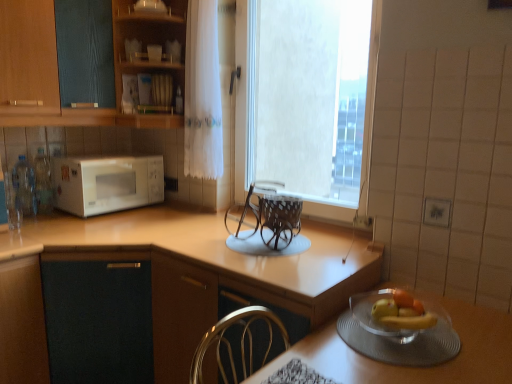
Describe the element at coordinates (146, 55) in the screenshot. This screenshot has width=512, height=384. I see `wooden shelves at upper center, arranged as the first cabinetry when viewed from the right` at that location.

Identify the location of wooden shelves at upper center, arranged as the first cabinetry when viewed from the right. Image resolution: width=512 pixels, height=384 pixels. (146, 55).

This screenshot has width=512, height=384. Describe the element at coordinates (414, 368) in the screenshot. I see `clear glass bowl at lower right` at that location.

The height and width of the screenshot is (384, 512). Describe the element at coordinates (106, 183) in the screenshot. I see `white matte microwave at left` at that location.

Measure the distance between brown woven basket at center and camera.

brown woven basket at center and camera are 1.69 meters apart from each other.

Where is `brown woven basket at center`? This screenshot has width=512, height=384. brown woven basket at center is located at coordinates (266, 223).

This screenshot has height=384, width=512. Identify the location of wooden cabinet at upper left, the second cabinetry when ordered from right to left. (57, 65).

How much space does wooden cabinet at upper left, the second cabinetry when ordered from right to left, occupy vertically?

wooden cabinet at upper left, the second cabinetry when ordered from right to left, is 69.28 centimeters in height.

The image size is (512, 384). Identify the location of white textured window at center. (306, 99).

Identify the location of wooden shelves at upper center, arranged as the first cabinetry when viewed from the right. Image resolution: width=512 pixels, height=384 pixels. (146, 55).

Can you tell me how much brown woven basket at center and clear plastic bottles at left, which is counted as the second bottle, starting from the right, differ in facing direction?

The facing directions of brown woven basket at center and clear plastic bottles at left, which is counted as the second bottle, starting from the right, are 90 degrees apart.

From the image's perspective, relative to clear plastic bottles at left, which is counted as the second bottle, starting from the right, is brown woven basket at center above or below?

From the image's perspective, brown woven basket at center appears below clear plastic bottles at left, which is counted as the second bottle, starting from the right.

Consider the image. Considering the positions of objects brown woven basket at center and clear plastic bottles at left, which is counted as the second bottle, starting from the right, in the image provided, who is in front, brown woven basket at center or clear plastic bottles at left, which is counted as the second bottle, starting from the right,?

brown woven basket at center.

Is brown woven basket at center next to clear plastic bottles at left, the first bottle in the left-to-right sequence, and touching it?

brown woven basket at center and clear plastic bottles at left, the first bottle in the left-to-right sequence, are clearly separated.

In the image, is clear plastic bottles at left, the first bottle in the left-to-right sequence, on the left side or the right side of white sheer curtain at center?

From the image, it's evident that clear plastic bottles at left, the first bottle in the left-to-right sequence, is to the left of white sheer curtain at center.

Is white sheer curtain at center surrounded by clear plastic bottles at left, which is counted as the second bottle, starting from the right?

Actually, white sheer curtain at center is outside clear plastic bottles at left, which is counted as the second bottle, starting from the right.

From the image's perspective, is clear plastic bottles at left, the first bottle in the left-to-right sequence, positioned above or below white sheer curtain at center?

Based on their image positions, clear plastic bottles at left, the first bottle in the left-to-right sequence, is located beneath white sheer curtain at center.

Is light brown laminate countertop at left not inside wooden cabinet at upper left, the second cabinetry when ordered from right to left?

light brown laminate countertop at left lies outside wooden cabinet at upper left, the second cabinetry when ordered from right to left,'s area.

From the image's perspective, is light brown laminate countertop at left located above wooden cabinet at upper left, placed as the 1th cabinetry when sorted from left to right?

No, from the image's perspective, light brown laminate countertop at left is not on top of wooden cabinet at upper left, placed as the 1th cabinetry when sorted from left to right.

Is light brown laminate countertop at left in front of or behind wooden cabinet at upper left, placed as the 1th cabinetry when sorted from left to right, in the image?

light brown laminate countertop at left is in front of wooden cabinet at upper left, placed as the 1th cabinetry when sorted from left to right.

Considering the relative sizes of light brown laminate countertop at left and wooden cabinet at upper left, placed as the 1th cabinetry when sorted from left to right, in the image provided, is light brown laminate countertop at left thinner than wooden cabinet at upper left, placed as the 1th cabinetry when sorted from left to right,?

No, light brown laminate countertop at left is not thinner than wooden cabinet at upper left, placed as the 1th cabinetry when sorted from left to right.

Consider the image. Measure the distance from brown woven basket at center to clear glass bowl at lower right.

brown woven basket at center and clear glass bowl at lower right are 25.77 inches apart from each other.

Which is behind, brown woven basket at center or clear glass bowl at lower right?

brown woven basket at center is more distant.

From the image's perspective, does brown woven basket at center appear lower than clear glass bowl at lower right?

No, from the image's perspective, brown woven basket at center is not beneath clear glass bowl at lower right.

Looking at this image, from the image's perspective, would you say light brown laminate countertop at left is shown under clear glass bottle at left, which is the second bottle from left to right?

Indeed, from the image's perspective, light brown laminate countertop at left is shown beneath clear glass bottle at left, which is the second bottle from left to right.

Is light brown laminate countertop at left situated inside clear glass bottle at left, which is the 1th bottle in right-to-left order, or outside?

light brown laminate countertop at left is not inside clear glass bottle at left, which is the 1th bottle in right-to-left order, it's outside.

From a real-world perspective, between light brown laminate countertop at left and clear glass bottle at left, which is the second bottle from left to right, who is vertically higher?

From a 3D spatial view, clear glass bottle at left, which is the second bottle from left to right, is above.

Is white textured window at center at the back of brown woven basket at center?

That's right, brown woven basket at center is facing away from white textured window at center.

Between brown woven basket at center and white textured window at center, which one is positioned behind?

white textured window at center is further away from the camera.

Is brown woven basket at center inside or outside of white textured window at center?

brown woven basket at center is located beyond the bounds of white textured window at center.

Is white matte microwave at left not inside clear plastic bottles at left, which is counted as the second bottle, starting from the right?

white matte microwave at left is positioned outside clear plastic bottles at left, which is counted as the second bottle, starting from the right.

Between white matte microwave at left and clear plastic bottles at left, which is counted as the second bottle, starting from the right, which one is positioned in front?

white matte microwave at left is more forward.

Does white matte microwave at left turn towards clear plastic bottles at left, the first bottle in the left-to-right sequence?

No, white matte microwave at left is not oriented towards clear plastic bottles at left, the first bottle in the left-to-right sequence.

The width and height of the screenshot is (512, 384). Find the location of `the 2nd bottle to the left when counting from the brown woven basket at center`. the 2nd bottle to the left when counting from the brown woven basket at center is located at coordinates (25, 186).

Where is `curtain in front of the clear plastic bottles at left, which is counted as the second bottle, starting from the right`? The height and width of the screenshot is (384, 512). curtain in front of the clear plastic bottles at left, which is counted as the second bottle, starting from the right is located at coordinates (202, 93).

Based on their spatial positions, is wooden cabinet at upper left, placed as the 1th cabinetry when sorted from left to right, or light brown laminate countertop at left closer to clear plastic bottles at left, which is counted as the second bottle, starting from the right?

wooden cabinet at upper left, placed as the 1th cabinetry when sorted from left to right, is positioned closer to the anchor clear plastic bottles at left, which is counted as the second bottle, starting from the right.

Based on the photo, looking at the image, which one is located further to clear glass bowl at lower right, white textured window at center or white matte microwave at left?

Among the two, white textured window at center is located further to clear glass bowl at lower right.

Estimate the real-world distances between objects in this image. Which object is further from clear glass bottle at left, which is the second bottle from left to right, white textured window at center or wooden cabinet at upper left, placed as the 1th cabinetry when sorted from left to right?

white textured window at center.

Looking at the image, which one is located closer to brown woven basket at center, white matte microwave at left or light brown laminate countertop at left?

light brown laminate countertop at left is positioned closer to the anchor brown woven basket at center.

Looking at the image, which one is located further to clear plastic bottles at left, the first bottle in the left-to-right sequence, white matte microwave at left or brown woven basket at center?

Based on the image, brown woven basket at center appears to be further to clear plastic bottles at left, the first bottle in the left-to-right sequence.

Based on the photo, considering their positions, is white matte microwave at left positioned closer to wooden shelves at upper center, arranged as the first cabinetry when viewed from the right, than clear plastic bottles at left, the first bottle in the left-to-right sequence?

Based on the image, white matte microwave at left appears to be nearer to wooden shelves at upper center, arranged as the first cabinetry when viewed from the right.

Looking at this image, based on their spatial positions, is clear plastic bottles at left, which is counted as the second bottle, starting from the right, or light brown laminate countertop at left closer to white sheer curtain at center?

light brown laminate countertop at left is closer to white sheer curtain at center.

Based on their spatial positions, is white sheer curtain at center or white textured window at center further from wooden cabinet at upper left, the second cabinetry when ordered from right to left?

white textured window at center lies further to wooden cabinet at upper left, the second cabinetry when ordered from right to left, than the other object.

Image resolution: width=512 pixels, height=384 pixels. In order to click on curtain between clear plastic bottles at left, which is counted as the second bottle, starting from the right, and white textured window at center, in the horizontal direction in this screenshot , I will do `click(202, 93)`.

I want to click on bottle located between clear plastic bottles at left, which is counted as the second bottle, starting from the right, and white sheer curtain at center in the left-right direction, so click(x=42, y=182).

This screenshot has width=512, height=384. Find the location of `curtain situated between wooden cabinet at upper left, the second cabinetry when ordered from right to left, and brown woven basket at center from left to right`. curtain situated between wooden cabinet at upper left, the second cabinetry when ordered from right to left, and brown woven basket at center from left to right is located at coordinates (202, 93).

Where is `countertop between clear glass bottle at left, which is the 1th bottle in right-to-left order, and brown woven basket at center from left to right`? countertop between clear glass bottle at left, which is the 1th bottle in right-to-left order, and brown woven basket at center from left to right is located at coordinates (170, 279).